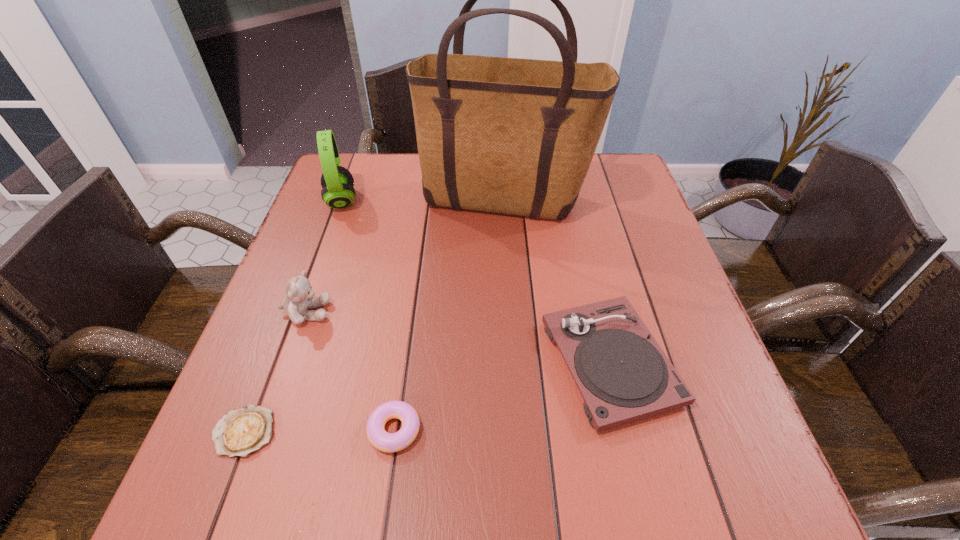
In order to click on vacant space situated on the back of the second shortest object in this screenshot , I will do `click(410, 320)`.

This screenshot has width=960, height=540. I want to click on free space located on the back of the quiche, so click(x=297, y=296).

You are a GUI agent. You are given a task and a screenshot of the screen. Output one action in this format:
    pyautogui.click(x=<x>, y=<y>)
    Task: Click on the tote bag located in the far edge section of the desktop
    The height and width of the screenshot is (540, 960).
    Given the screenshot: What is the action you would take?
    pyautogui.click(x=515, y=136)

This screenshot has height=540, width=960. I want to click on headset that is at the far edge, so click(x=337, y=182).

This screenshot has width=960, height=540. What are the coordinates of `headset that is at the left edge` in the screenshot? It's located at (337, 182).

Where is `teddy bear present at the left edge`? teddy bear present at the left edge is located at coordinates (299, 298).

Where is `quiche that is at the left edge`? quiche that is at the left edge is located at coordinates (240, 432).

You are a GUI agent. You are given a task and a screenshot of the screen. Output one action in this format:
    pyautogui.click(x=<x>, y=<y>)
    Task: Click on the tote bag that is at the right edge
    This screenshot has height=540, width=960.
    Given the screenshot: What is the action you would take?
    pyautogui.click(x=515, y=136)

The width and height of the screenshot is (960, 540). Find the location of `phonograph_record present at the right edge`. phonograph_record present at the right edge is located at coordinates (623, 375).

Where is `object that is positioned at the far left corner`? This screenshot has width=960, height=540. object that is positioned at the far left corner is located at coordinates (337, 182).